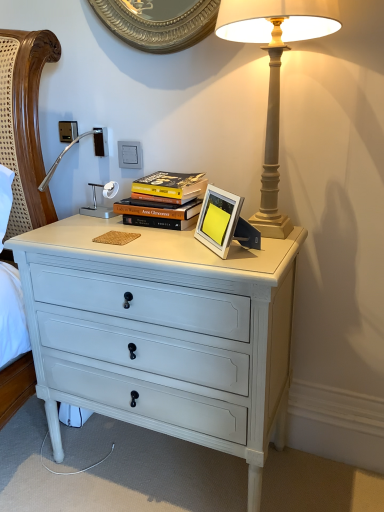
Question: Is white plastic electric outlet at upper center further to the viewer compared to hardcover books at center?

Choices:
 (A) yes
 (B) no

Answer: (A)

Question: Is white plastic electric outlet at upper center at the right side of hardcover books at center?

Choices:
 (A) yes
 (B) no

Answer: (B)

Question: Is white plastic electric outlet at upper center facing away from hardcover books at center?

Choices:
 (A) yes
 (B) no

Answer: (B)

Question: Considering the relative sizes of white plastic electric outlet at upper center and hardcover books at center in the image provided, is white plastic electric outlet at upper center bigger than hardcover books at center?

Choices:
 (A) no
 (B) yes

Answer: (A)

Question: From a real-world perspective, is white plastic electric outlet at upper center physically below hardcover books at center?

Choices:
 (A) yes
 (B) no

Answer: (B)

Question: From a real-world perspective, is white plastic electric outlet at upper center physically above hardcover books at center?

Choices:
 (A) yes
 (B) no

Answer: (A)

Question: Can you confirm if silver metallic picture frame at center is wider than white plastic electric outlet at upper center?

Choices:
 (A) yes
 (B) no

Answer: (A)

Question: From a real-world perspective, is silver metallic picture frame at center located beneath white plastic electric outlet at upper center?

Choices:
 (A) no
 (B) yes

Answer: (B)

Question: From the image's perspective, is silver metallic picture frame at center located beneath white plastic electric outlet at upper center?

Choices:
 (A) yes
 (B) no

Answer: (A)

Question: Considering the relative positions of silver metallic picture frame at center and white plastic electric outlet at upper center in the image provided, is silver metallic picture frame at center to the left of white plastic electric outlet at upper center from the viewer's perspective?

Choices:
 (A) yes
 (B) no

Answer: (B)

Question: Does silver metallic picture frame at center lie in front of white plastic electric outlet at upper center?

Choices:
 (A) no
 (B) yes

Answer: (B)

Question: Considering the relative positions of silver metallic picture frame at center and white plastic electric outlet at upper center in the image provided, is silver metallic picture frame at center behind white plastic electric outlet at upper center?

Choices:
 (A) no
 (B) yes

Answer: (A)

Question: Does white painted wood chest of drawers at center lie in front of white plastic electric outlet at upper center?

Choices:
 (A) no
 (B) yes

Answer: (B)